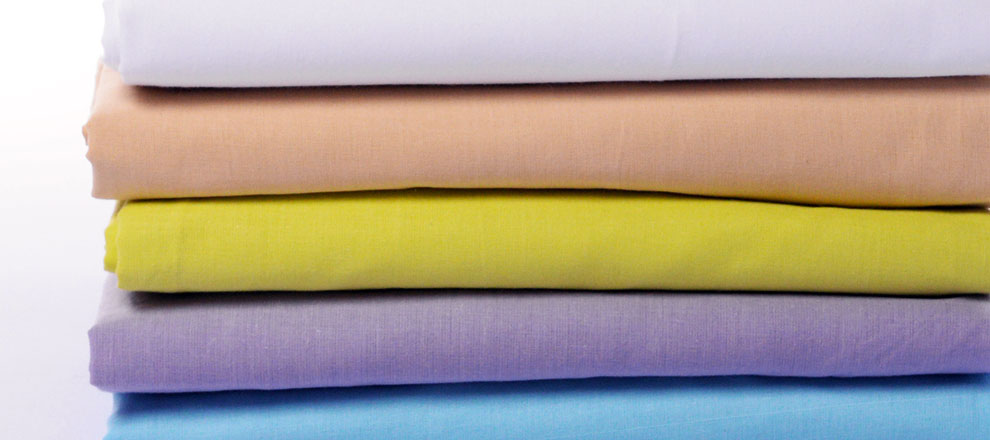
The width and height of the screenshot is (990, 440). Find the location of `folded laundry`. folded laundry is located at coordinates coord(265,38), coord(162,172), coord(238,232), coord(249,345), coord(433,434).